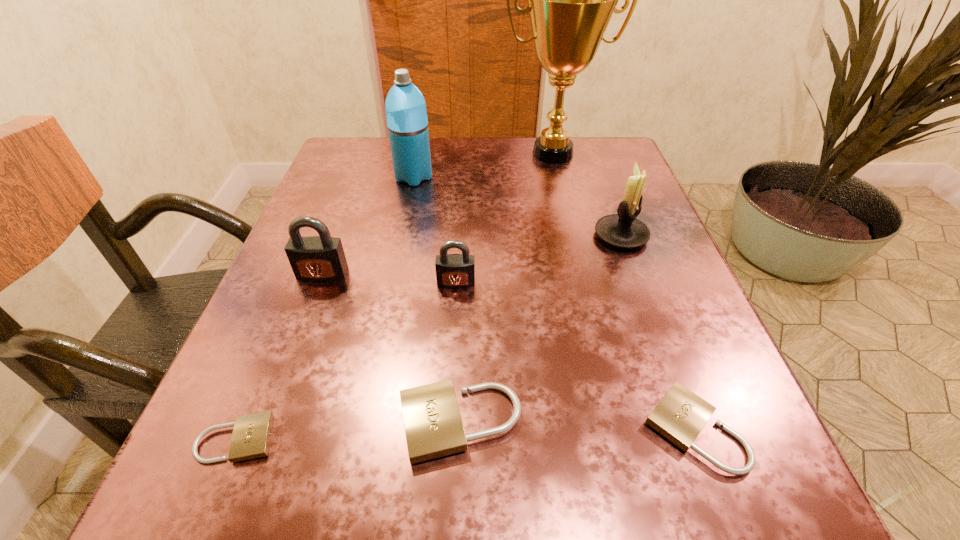
Identify the location of object positioned at the far left corner. (406, 114).

The width and height of the screenshot is (960, 540). I want to click on object positioned at the near left corner, so click(x=251, y=436).

At what (x,y) coordinates should I click in order to perform the action: click on object that is at the far right corner. Please return your answer as a coordinate pair (x, y). This screenshot has height=540, width=960. Looking at the image, I should click on (570, 0).

Find the location of a particular element. Image resolution: width=960 pixels, height=540 pixels. object positioned at the near right corner is located at coordinates (680, 415).

In the image, there is a desktop. Where is `free region at the far edge`? free region at the far edge is located at coordinates (538, 159).

Where is `vacant area at the near edge of the desktop`? The height and width of the screenshot is (540, 960). vacant area at the near edge of the desktop is located at coordinates (400, 525).

Identify the location of blank space at the left edge of the desktop. The height and width of the screenshot is (540, 960). (298, 424).

The image size is (960, 540). In the image, there is a desktop. In order to click on blank space at the right edge in this screenshot , I will do `click(634, 303)`.

In the image, there is a desktop. Find the location of `free region at the far left corner`. free region at the far left corner is located at coordinates (374, 154).

The height and width of the screenshot is (540, 960). I want to click on free location at the near left corner, so click(x=216, y=537).